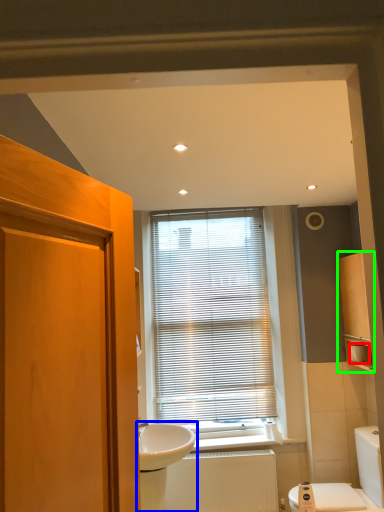
Question: Which object is the closest to the toilet paper (highlighted by a red box)? Choose among these: sink (highlighted by a blue box) or cabinetry (highlighted by a green box).

Choices:
 (A) sink
 (B) cabinetry

Answer: (B)